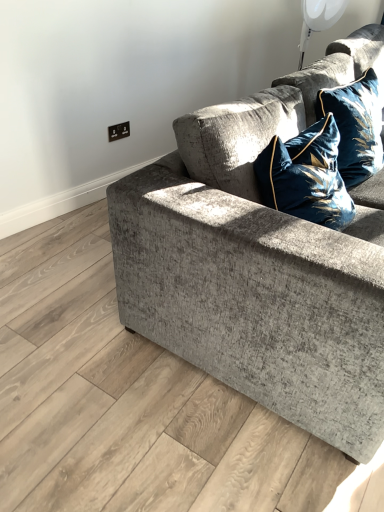
Image resolution: width=384 pixels, height=512 pixels. Describe the element at coordinates (261, 263) in the screenshot. I see `textured gray couch at center` at that location.

The width and height of the screenshot is (384, 512). What are the coordinates of `textured gray couch at center` in the screenshot? It's located at (261, 263).

Identify the location of velvet blue pillow at upper right. This screenshot has height=512, width=384. (355, 126).

Measure the distance between point (x=367, y=108) and camera.

5.75 feet.

The image size is (384, 512). What do you see at coordinates (355, 126) in the screenshot? I see `velvet blue pillow at upper right` at bounding box center [355, 126].

The height and width of the screenshot is (512, 384). What are the coordinates of `textured gray couch at center` in the screenshot? It's located at pos(261,263).

Considering the positions of objects velvet blue pillow at upper right and textured gray couch at center in the image provided, who is more to the left, velvet blue pillow at upper right or textured gray couch at center?

velvet blue pillow at upper right.

Considering their positions, is velvet blue pillow at upper right located in front of or behind textured gray couch at center?

Visually, velvet blue pillow at upper right is located behind textured gray couch at center.

Which is in front, point (375, 131) or point (331, 295)?

The point (331, 295) is closer to the camera.

From the image's perspective, does velvet blue pillow at upper right appear lower than textured gray couch at center?

No, from the image's perspective, velvet blue pillow at upper right is not beneath textured gray couch at center.

From a real-world perspective, is velvet blue pillow at upper right physically located above or below textured gray couch at center?

From a real-world perspective, velvet blue pillow at upper right is physically above textured gray couch at center.

Considering the sizes of objects velvet blue pillow at upper right and textured gray couch at center in the image provided, who is wider, velvet blue pillow at upper right or textured gray couch at center?

Wider between the two is textured gray couch at center.

Considering the sizes of objects velvet blue pillow at upper right and textured gray couch at center in the image provided, who is shorter, velvet blue pillow at upper right or textured gray couch at center?

With less height is velvet blue pillow at upper right.

Considering the relative sizes of velvet blue pillow at upper right and textured gray couch at center in the image provided, is velvet blue pillow at upper right smaller than textured gray couch at center?

Yes.

Which is correct: velvet blue pillow at upper right is inside textured gray couch at center, or outside of it?

→ velvet blue pillow at upper right is located inside textured gray couch at center.

Would you consider velvet blue pillow at upper right to be distant from textured gray couch at center?

No, there isn't a large distance between velvet blue pillow at upper right and textured gray couch at center.

Is velvet blue pillow at upper right oriented away from textured gray couch at center?

Yes, textured gray couch at center is at the back of velvet blue pillow at upper right.

Locate an element on the screen. The width and height of the screenshot is (384, 512). studio couch beneath the velvet blue pillow at upper right (from a real-world perspective) is located at coordinates (261, 263).

Which is more to the left, textured gray couch at center or velvet blue pillow at upper right?

velvet blue pillow at upper right.

Which object is further away from the camera taking this photo, textured gray couch at center or velvet blue pillow at upper right?

Positioned behind is velvet blue pillow at upper right.

Is point (274, 214) positioned behind point (344, 133)?

No, (274, 214) is in front of (344, 133).

From the picture: From the image's perspective, is textured gray couch at center under velvet blue pillow at upper right?

Indeed, from the image's perspective, textured gray couch at center is shown beneath velvet blue pillow at upper right.

From a real-world perspective, which is physically below, textured gray couch at center or velvet blue pillow at upper right?

textured gray couch at center, from a real-world perspective.

Between textured gray couch at center and velvet blue pillow at upper right, which one has larger width?

textured gray couch at center is wider.

Does textured gray couch at center have a greater height compared to velvet blue pillow at upper right?

Yes.

Considering the sizes of objects textured gray couch at center and velvet blue pillow at upper right in the image provided, who is smaller, textured gray couch at center or velvet blue pillow at upper right?

With smaller size is velvet blue pillow at upper right.

Is velvet blue pillow at upper right a part of textured gray couch at center?

Yes, velvet blue pillow at upper right is surrounded by textured gray couch at center.

Would you say textured gray couch at center is a long distance from velvet blue pillow at upper right?

No, textured gray couch at center is in close proximity to velvet blue pillow at upper right.

Is textured gray couch at center oriented towards velvet blue pillow at upper right?

Yes, textured gray couch at center is turned towards velvet blue pillow at upper right.

Can you tell me how much textured gray couch at center and velvet blue pillow at upper right differ in facing direction?

7.87 degrees.

Identify the location of studio couch that is below the velvet blue pillow at upper right (from the image's perspective). (261, 263).

Locate an element on the screen. pillow that appears behind the textured gray couch at center is located at coordinates (355, 126).

The image size is (384, 512). I want to click on pillow above the textured gray couch at center (from a real-world perspective), so click(x=355, y=126).